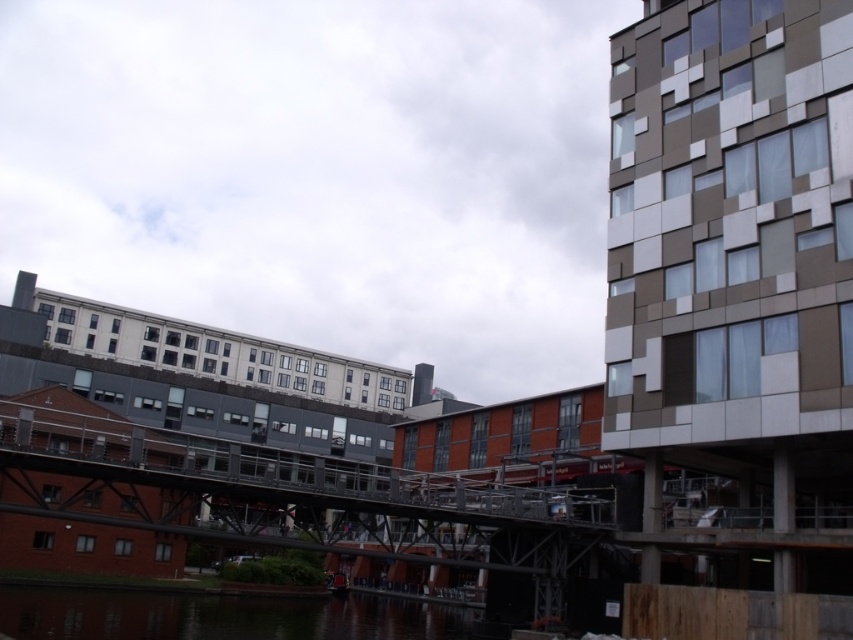
You are a drone operator who needs to capture aerial footage of the metallic gray bridge at center. The drone has a maximum flight range of 30 meters. Can the drone reach the bridge?

The metallic gray bridge at center is 31.62 meters away from camera, which exceeds the drone maximum flight range of 30 meters. The drone cannot reach the bridge.

Based on the photo, you are standing at the riverside and want to cross to the other side. The metallic gray bridge at center is your only option. Based on its position, can you estimate where exactly the bridge is located in the image?

The metallic gray bridge at center is located at coordinates 0.778 on the x axis and 0.334 on the y axis.